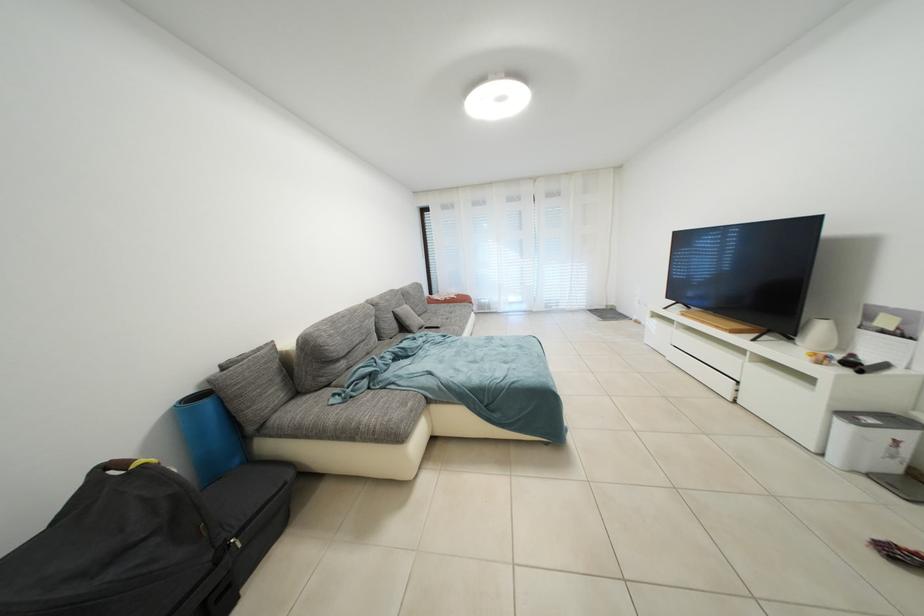
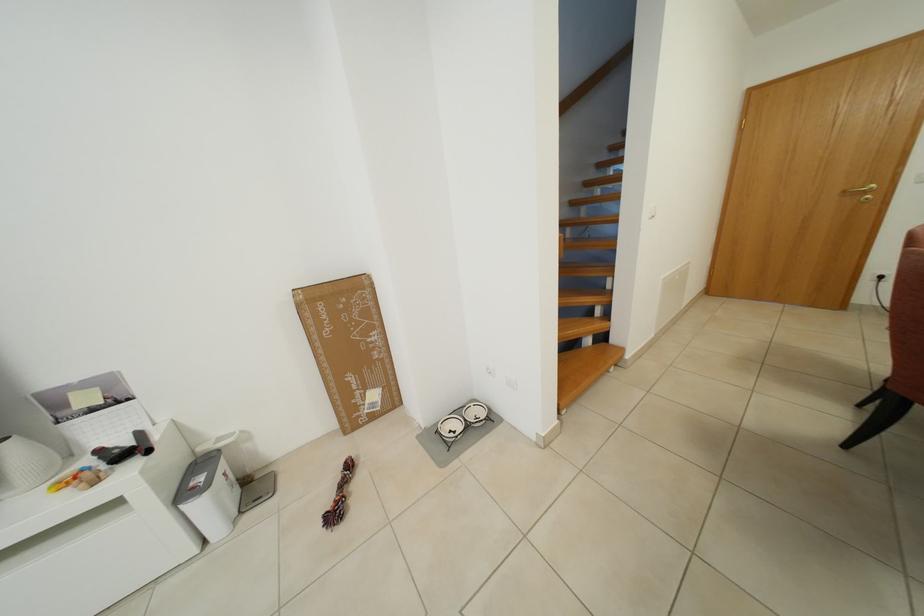
Where in the second image is the point corresponding to the point at 828,367 from the first image?

(103, 485)